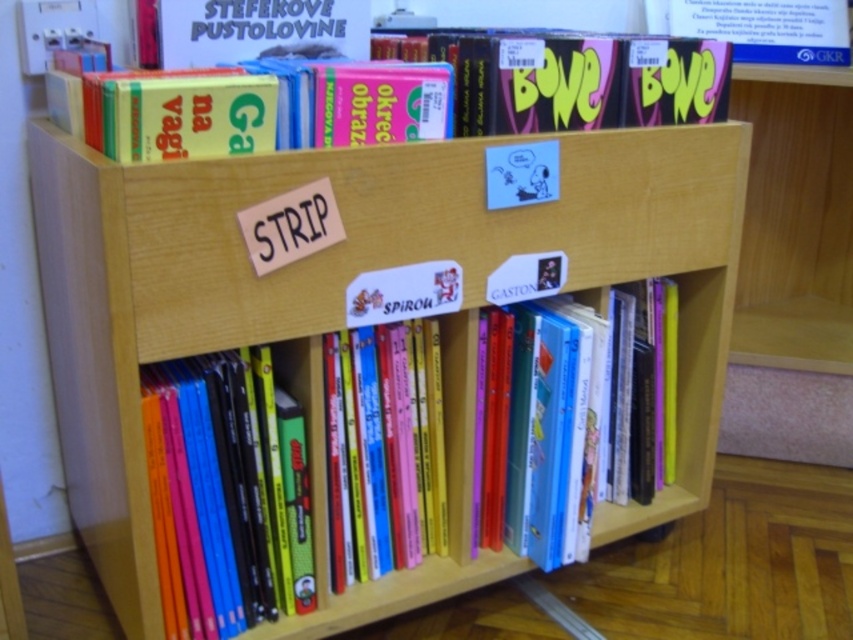
You are organizing a library and need to place a new book that requires a shelf space taller than the hardcover comic books at lower left. Can the hardcover book at center provide enough height for this?

The hardcover comic books at lower left is not as tall as the hardcover book at center, so the hardcover book at center has sufficient height to accommodate the new book needing more space than the comic books.

You are standing in front of the bookshelf and want to reach two points marked on it. The first point is at coordinates point (546, 317) and the second is at point (833, 44). Which point is closer to you?

Point (546, 317) is closer to the viewer than point (833, 44).